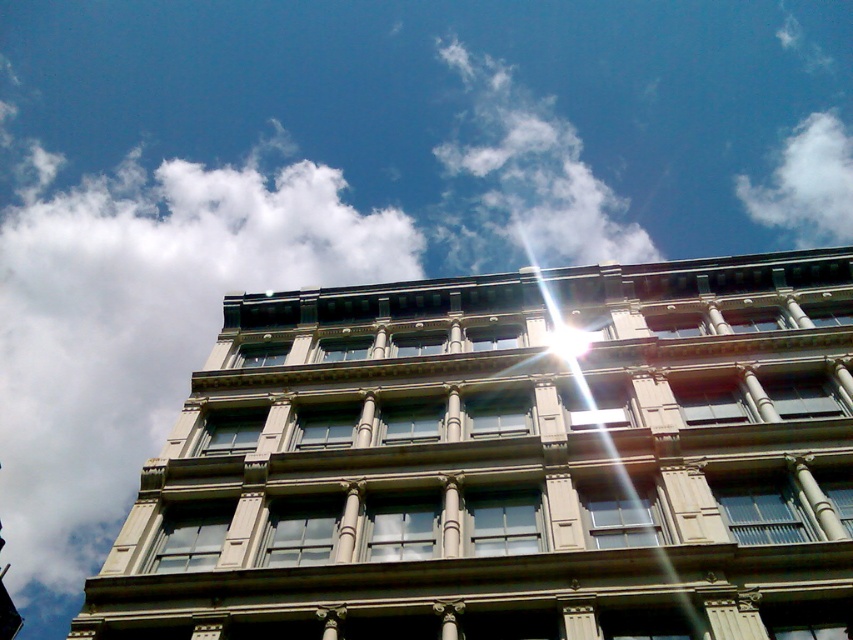
Which is above, white fluffy cloud at upper left or white fluffy cloud at upper right?

white fluffy cloud at upper right is above.

Is white fluffy cloud at upper left shorter than white fluffy cloud at upper right?

No.

Who is more distant from viewer, (38, 416) or (778, 156)?

Positioned behind is point (38, 416).

Image resolution: width=853 pixels, height=640 pixels. I want to click on white fluffy cloud at upper left, so click(141, 324).

Does point (511, 131) come behind point (824, 193)?

No, (511, 131) is in front of (824, 193).

Where is `white fluffy cloud at upper center`? The image size is (853, 640). white fluffy cloud at upper center is located at coordinates (524, 182).

Between white fluffy cloud at upper left and white fluffy cloud at upper center, which one has more height?

Standing taller between the two is white fluffy cloud at upper left.

Does white fluffy cloud at upper left appear on the right side of white fluffy cloud at upper center?

In fact, white fluffy cloud at upper left is to the left of white fluffy cloud at upper center.

In order to click on white fluffy cloud at upper left in this screenshot , I will do `click(141, 324)`.